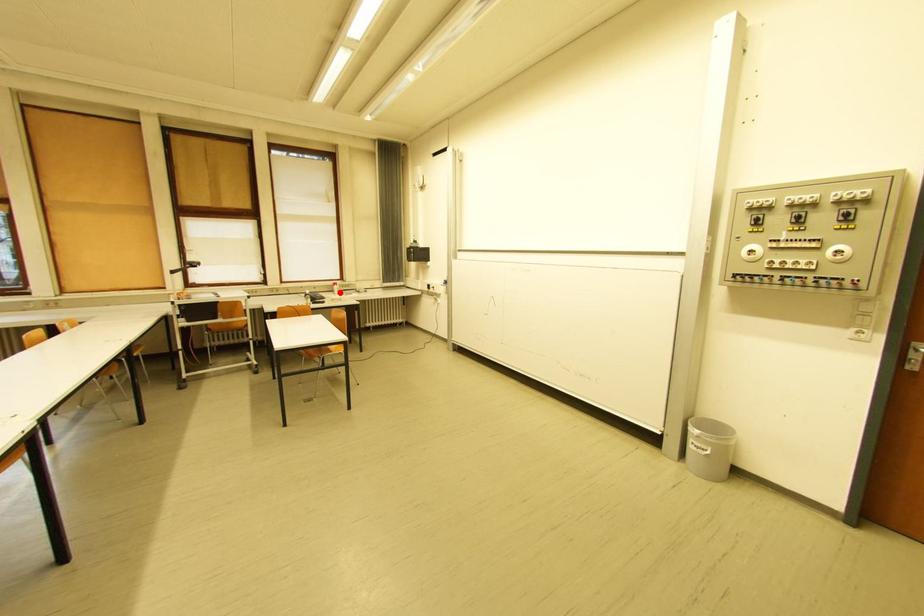
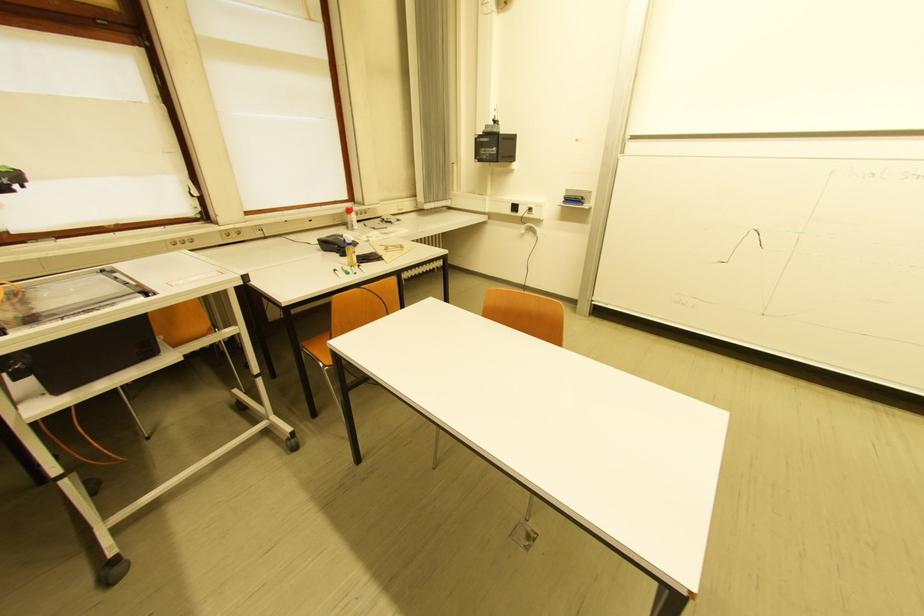
In the second image, find the point that corresponds to the highlighted location in the first image.

(351, 225)